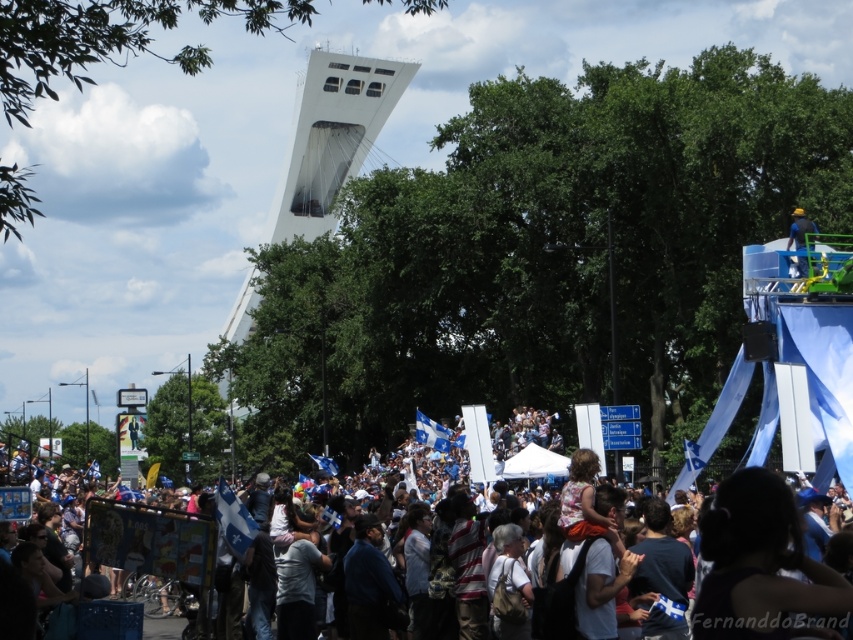
Question: Is white cotton crowd at lower center further to camera compared to yellow matte helmet at upper right?

Choices:
 (A) no
 (B) yes

Answer: (A)

Question: Which point is closer to the camera?

Choices:
 (A) yellow matte helmet at upper right
 (B) white cotton crowd at lower center
 (C) white smooth tower at center

Answer: (B)

Question: In this image, where is white smooth tower at center located relative to white cotton crowd at lower center?

Choices:
 (A) above
 (B) below

Answer: (A)

Question: Is white smooth tower at center positioned behind yellow matte helmet at upper right?

Choices:
 (A) no
 (B) yes

Answer: (B)

Question: Which point appears farthest from the camera in this image?

Choices:
 (A) (352, 161)
 (B) (422, 464)
 (C) (795, 225)

Answer: (A)

Question: Among these points, which one is farthest from the camera?

Choices:
 (A) [x=294, y=173]
 (B) [x=799, y=216]
 (C) [x=613, y=428]

Answer: (A)